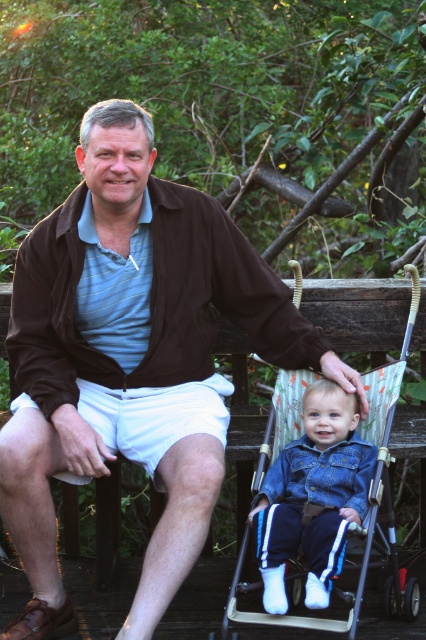
Does matte brown jacket at center appear under denim jacket at center?

Incorrect, matte brown jacket at center is not positioned below denim jacket at center.

Is the position of matte brown jacket at center more distant than that of denim jacket at center?

Yes, matte brown jacket at center is further from the viewer.

I want to click on matte brown jacket at center, so click(x=132, y=358).

Find the location of a particular element. matte brown jacket at center is located at coordinates (132, 358).

Can you confirm if matte brown jacket at center is thinner than denim fabric stroller at lower center?

No.

Who is more forward, (x=86, y=336) or (x=290, y=385)?

Point (x=86, y=336)

This screenshot has height=640, width=426. What are the coordinates of `matte brown jacket at center` in the screenshot? It's located at (132, 358).

Is denim jacket at center positioned before denim fabric stroller at lower center?

No, denim jacket at center is further to the viewer.

Is point (285, 460) less distant than point (340, 628)?

That is False.

Locate an element on the screen. This screenshot has height=640, width=426. denim jacket at center is located at coordinates (313, 497).